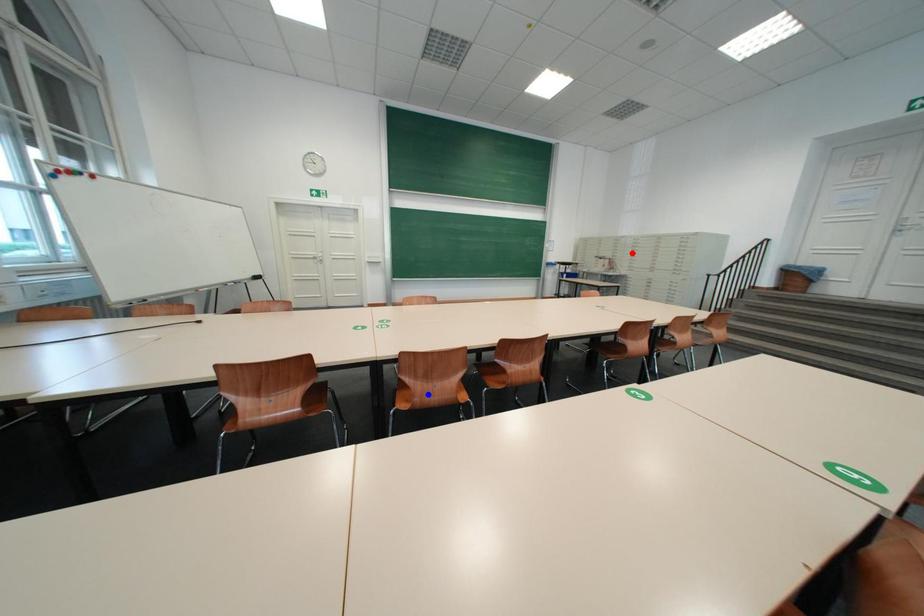
Question: Which of the two points in the image is closer to the camera?

Choices:
 (A) Blue point is closer.
 (B) Red point is closer.

Answer: (A)